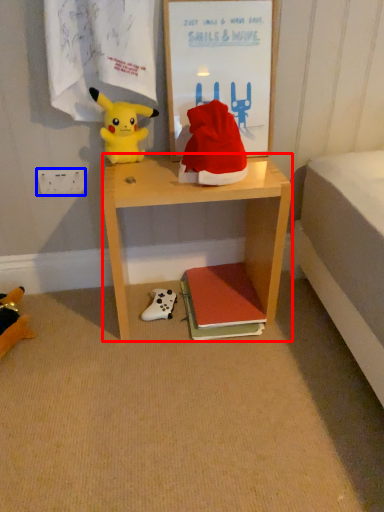
Question: Which of the following is the closest to the observer, desk (highlighted by a red box) or power outlet (highlighted by a blue box)?

Choices:
 (A) desk
 (B) power outlet

Answer: (A)